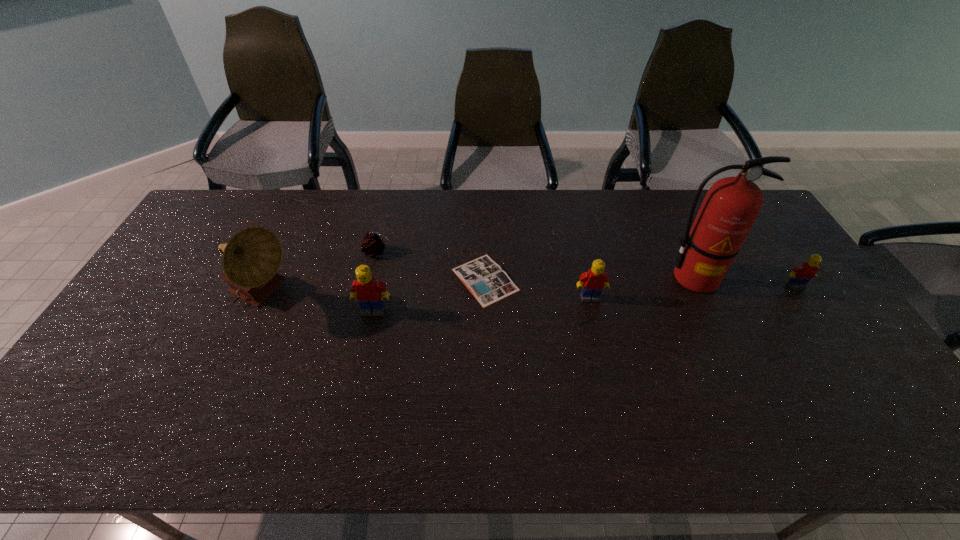
Where is `the fourth object from right to left`? This screenshot has width=960, height=540. the fourth object from right to left is located at coordinates (485, 279).

Identify the location of pinecone. (373, 244).

I want to click on blank space located on the front-facing side of the nearest Lego, so click(354, 396).

This screenshot has height=540, width=960. In order to click on vacant position located 0.190m on the front-facing side of the second shortest Lego in this screenshot , I will do `click(604, 357)`.

Where is `vacant space located 0.200m on the front-facing side of the third shortest object`? vacant space located 0.200m on the front-facing side of the third shortest object is located at coordinates (836, 345).

Find the location of a particular element. This screenshot has height=540, width=960. vacant space located 0.390m on the horn of the leftmost object is located at coordinates (431, 297).

Where is `vacant space situated on the side of the second object from right to left with the nozzle and handle`? vacant space situated on the side of the second object from right to left with the nozzle and handle is located at coordinates (743, 381).

The image size is (960, 540). Identify the location of free space located 0.100m on the right of the fourth object from left to right. (552, 280).

This screenshot has width=960, height=540. Find the location of `vacant area located 0.310m with a leaf charm attached to the second shortest object`. vacant area located 0.310m with a leaf charm attached to the second shortest object is located at coordinates (487, 252).

In order to click on object that is at the right edge in this screenshot , I will do `click(801, 274)`.